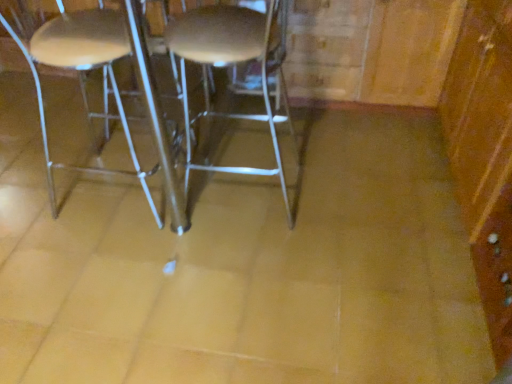
This screenshot has width=512, height=384. In order to click on free space that is in between metallic silver stool at center and metallic silver stool at left in this screenshot , I will do `click(214, 208)`.